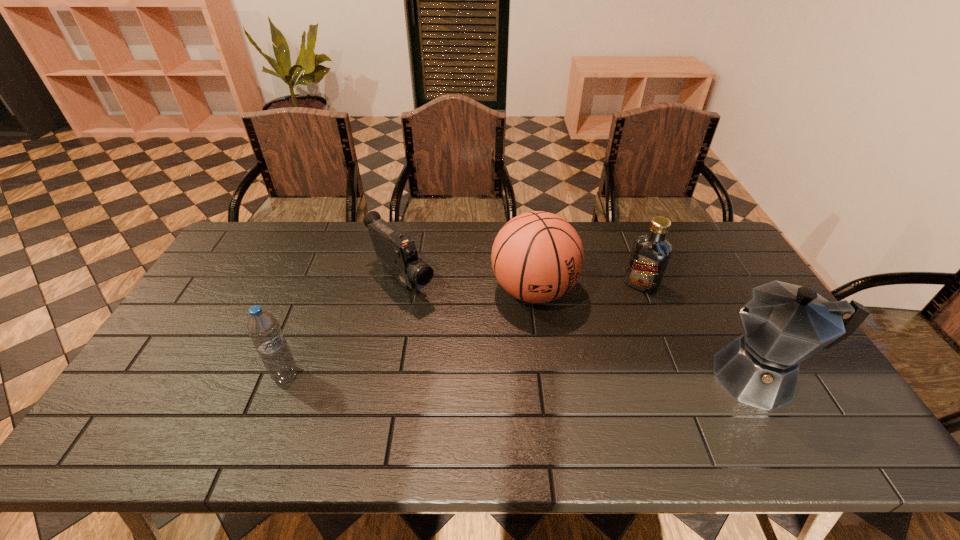
Image resolution: width=960 pixels, height=540 pixels. In order to click on vacant area between the shortest object and the leftmost object in this screenshot , I will do `click(344, 327)`.

Locate an element on the screen. unoccupied area between the rightmost object and the camcorder is located at coordinates 580,328.

Identify the location of empty location between the coffeepot and the basketball. The height and width of the screenshot is (540, 960). (646, 334).

Where is `free area in between the second object from right to left and the leftmost object`? free area in between the second object from right to left and the leftmost object is located at coordinates (464, 330).

Identify the location of free space between the water bottle and the camcorder. (344, 327).

At what (x,y) coordinates should I click in order to perform the action: click on blank region between the fourth object from right to left and the basketball. Please return your answer as a coordinate pair (x, y). The image size is (960, 540). Looking at the image, I should click on (468, 285).

Find the location of a particular element. The width and height of the screenshot is (960, 540). free space between the basketball and the water bottle is located at coordinates (410, 333).

The height and width of the screenshot is (540, 960). What are the coordinates of `empty space between the basketball and the water bottle` in the screenshot? It's located at (410, 333).

In order to click on vacant space that's between the shortest object and the third object from right to left in this screenshot , I will do tap(468, 285).

At what (x,y) coordinates should I click in order to perform the action: click on empty space that is in between the vodka and the coffeepot. Please return your answer as a coordinate pair (x, y). The width and height of the screenshot is (960, 540). Looking at the image, I should click on (700, 331).